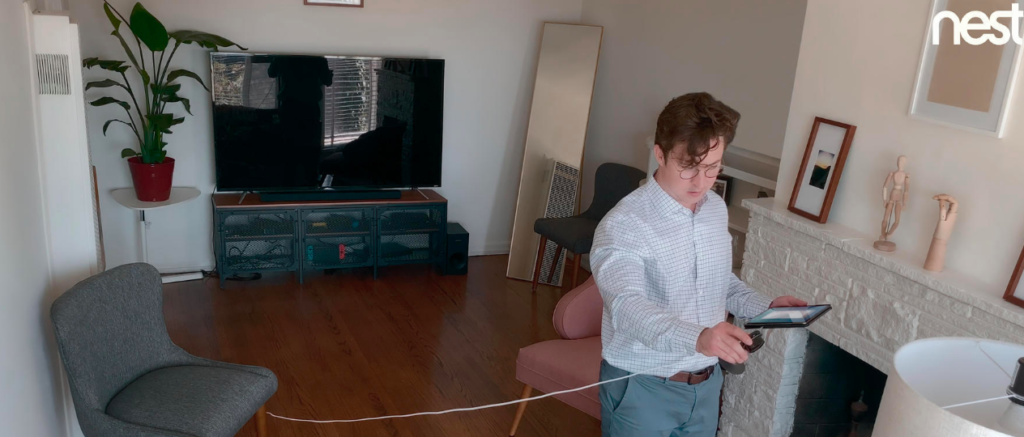
Identify the location of fireplace. This screenshot has width=1024, height=437. (859, 387).